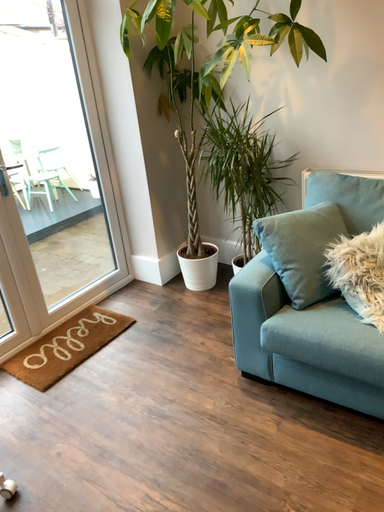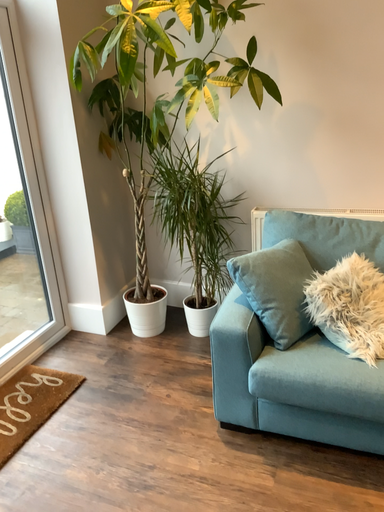
Question: How did the camera likely rotate when shooting the video?

Choices:
 (A) rotated right
 (B) rotated left

Answer: (A)